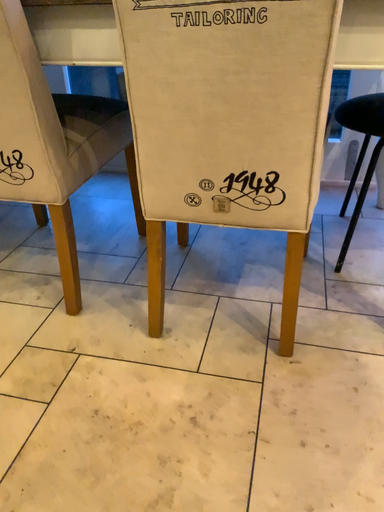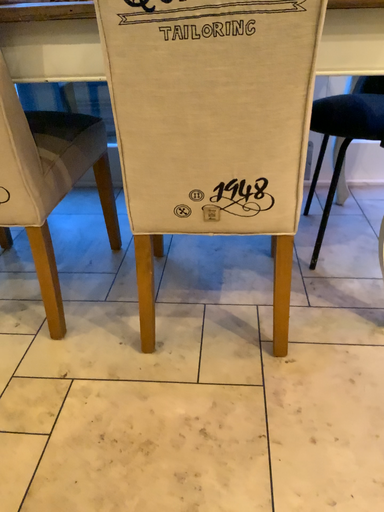
Question: Which way did the camera rotate in the video?

Choices:
 (A) rotated left
 (B) rotated right

Answer: (B)